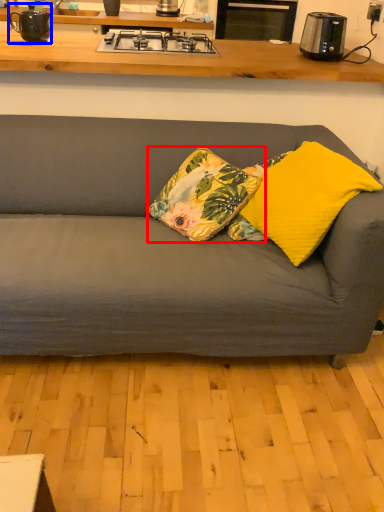
Question: Which object appears farthest to the camera in this image, pillow (highlighted by a red box) or appliance (highlighted by a blue box)?

Choices:
 (A) pillow
 (B) appliance

Answer: (B)